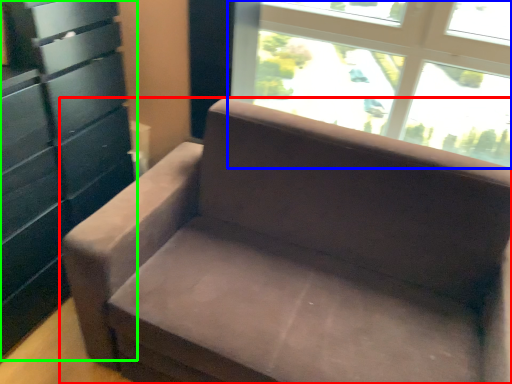
Question: Estimate the real-world distances between objects in this image. Which object is closer to studio couch (highlighted by a red box), window (highlighted by a blue box) or dresser (highlighted by a green box)?

Choices:
 (A) window
 (B) dresser

Answer: (B)